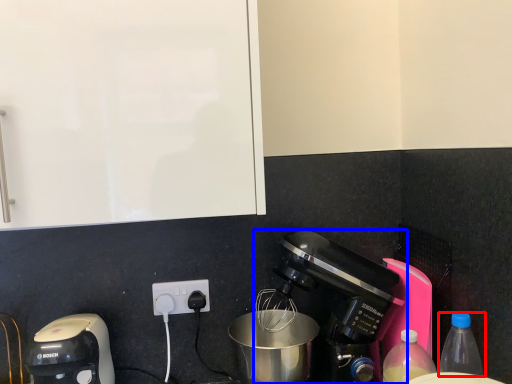
Question: Which point is closer to the camera, bottle (highlighted by a red box) or coffee maker (highlighted by a blue box)?

Choices:
 (A) bottle
 (B) coffee maker

Answer: (A)